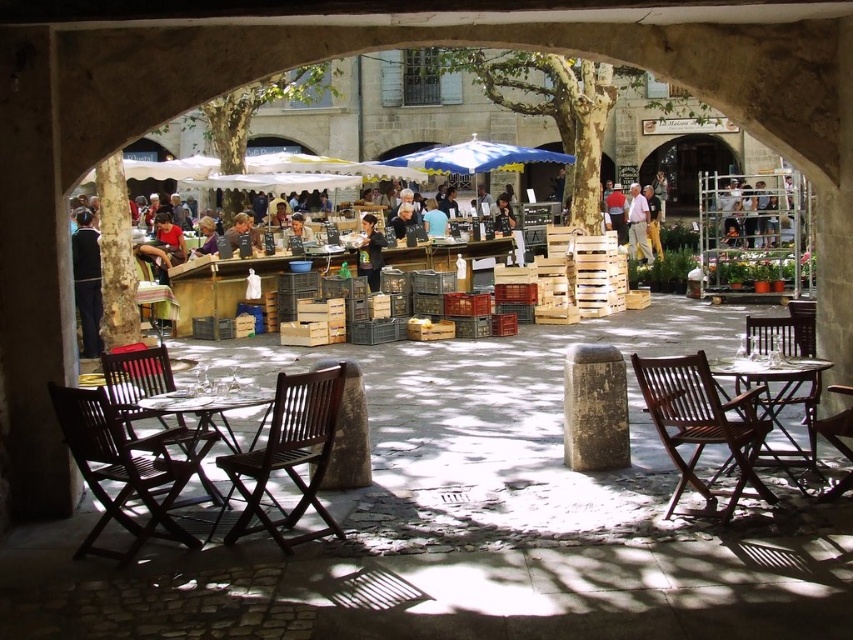
You are standing at the center of the cobblestone area in the market scene. You need to place a large potted plant. The wooden folding table at lower right is represented by point (782, 406). Where should you place the plant to avoid blocking the path to the table?

The wooden folding table at lower right is located at point (782, 406). To avoid blocking the path to the table, place the plant away from the main walkway leading towards this coordinate.